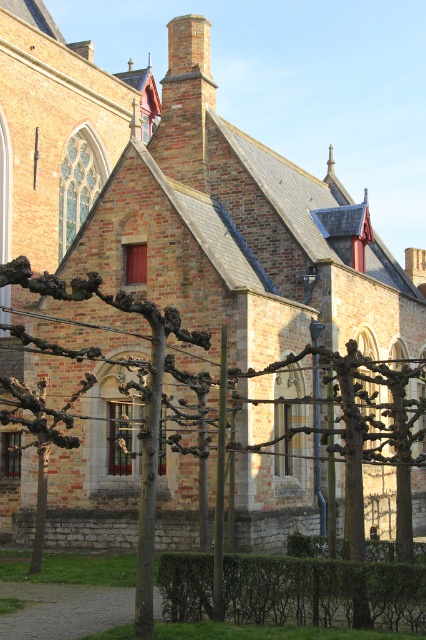
Is green leafy hedge at lower center closer to the viewer compared to bare branches at center?

No, green leafy hedge at lower center is behind bare branches at center.

Who is positioned more to the left, green leafy hedge at lower center or bare branches at center?

bare branches at center

Is point (244, 566) positioned after point (62, 291)?

Yes.

Find the location of a particular element. green leafy hedge at lower center is located at coordinates (322, 592).